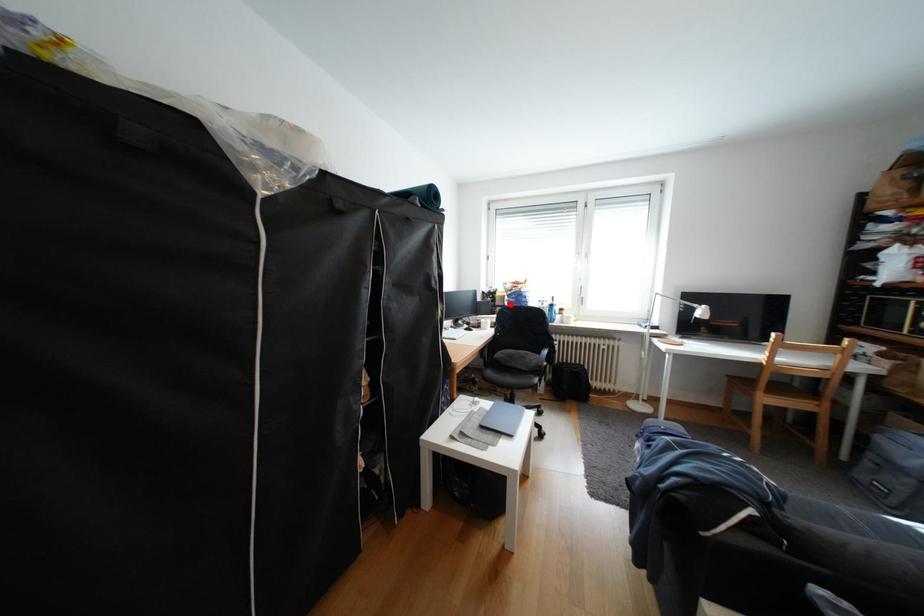
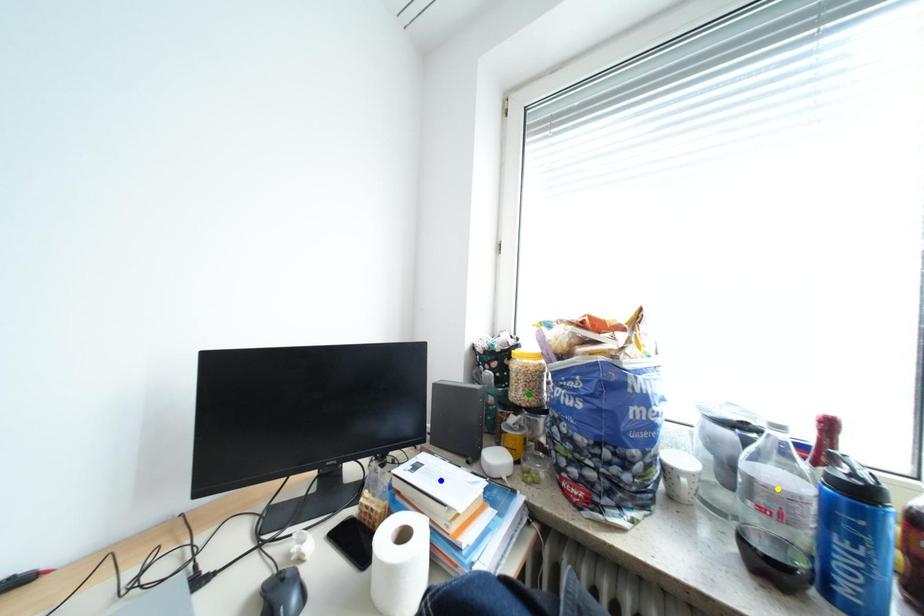
Question: I am providing you with two images of the same scene from different viewpoints. A red point is marked on the first image. You are given multiple points on the second image. Which point in image 2 is actually the same real-world point as the red point in image 1?

Choices:
 (A) blue point
 (B) yellow point
 (C) green point

Answer: (C)